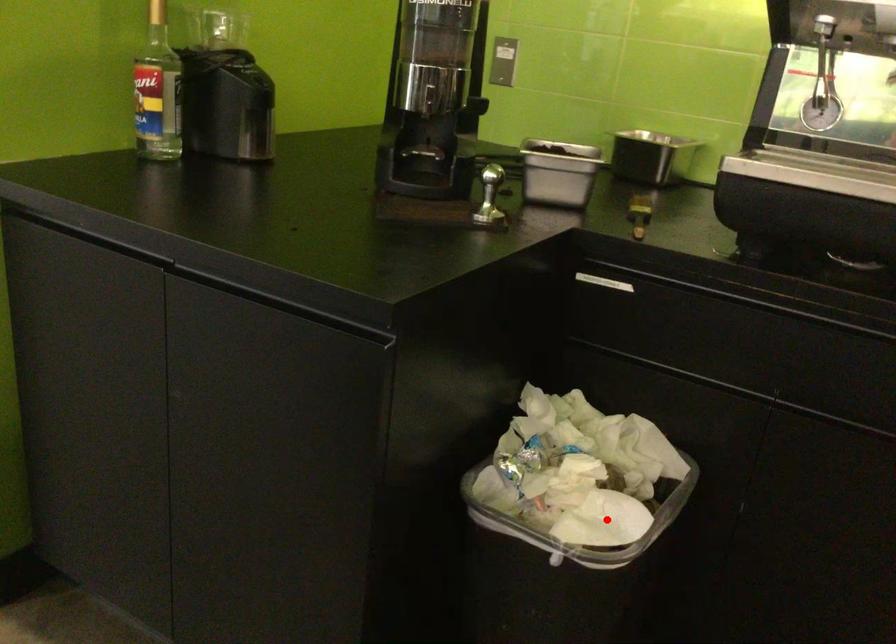
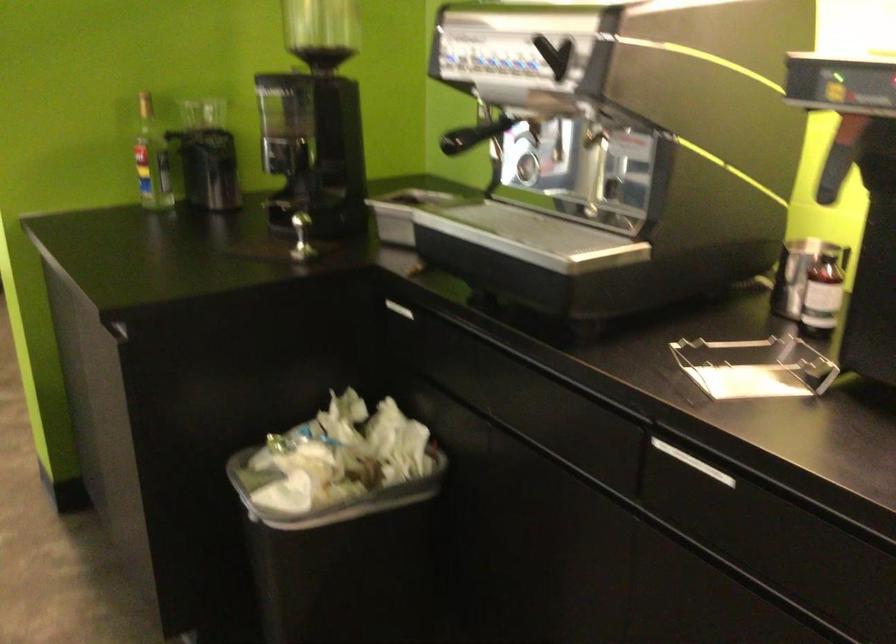
Question: I am providing you with two images of the same scene from different viewpoints. In image1, a red point is highlighted. Considering the same 3D point in image2, which of the following is correct?

Choices:
 (A) It is closer
 (B) It is farther

Answer: (B)